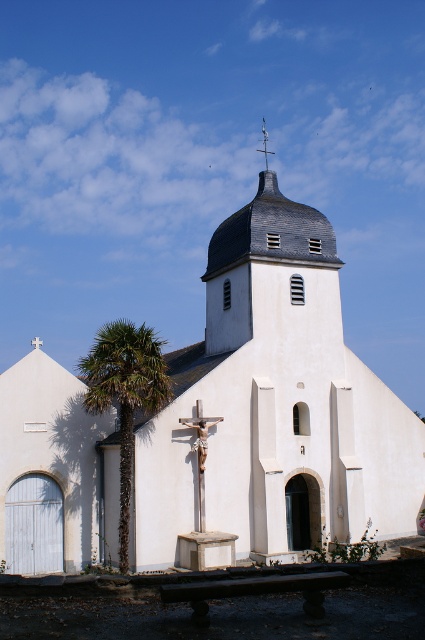
Question: Does polished silver spire at upper center appear over white wooden cross at upper center?

Choices:
 (A) yes
 (B) no

Answer: (A)

Question: Which point is farther from the camera taking this photo?

Choices:
 (A) (76, 433)
 (B) (99, 355)
 (C) (266, 168)
 (D) (36, 337)

Answer: (D)

Question: Does green leafy palm tree at left have a smaller size compared to white wooden cross at upper center?

Choices:
 (A) no
 (B) yes

Answer: (A)

Question: Is green leafy palm tree at left below white wooden cross at upper center?

Choices:
 (A) no
 (B) yes

Answer: (B)

Question: Estimate the real-world distances between objects in this image. Which object is closer to the white wooden cross at upper center?

Choices:
 (A) green leafy palm tree at left
 (B) polished silver spire at upper center

Answer: (A)

Question: Which object is the farthest from the white wooden cross at upper center?

Choices:
 (A) green leafy palm tree at left
 (B) white matte church at center

Answer: (A)